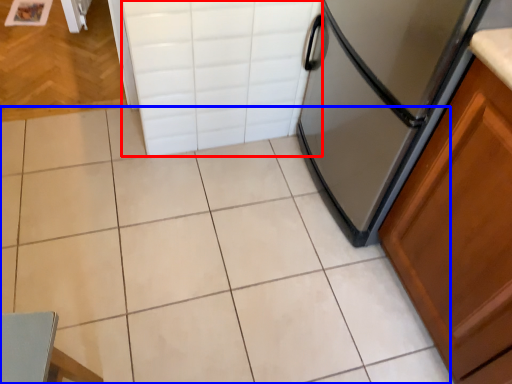
Question: Which point is closer to the camera, drawer (highlighted by a red box) or ceramic tile (highlighted by a blue box)?

Choices:
 (A) drawer
 (B) ceramic tile

Answer: (B)